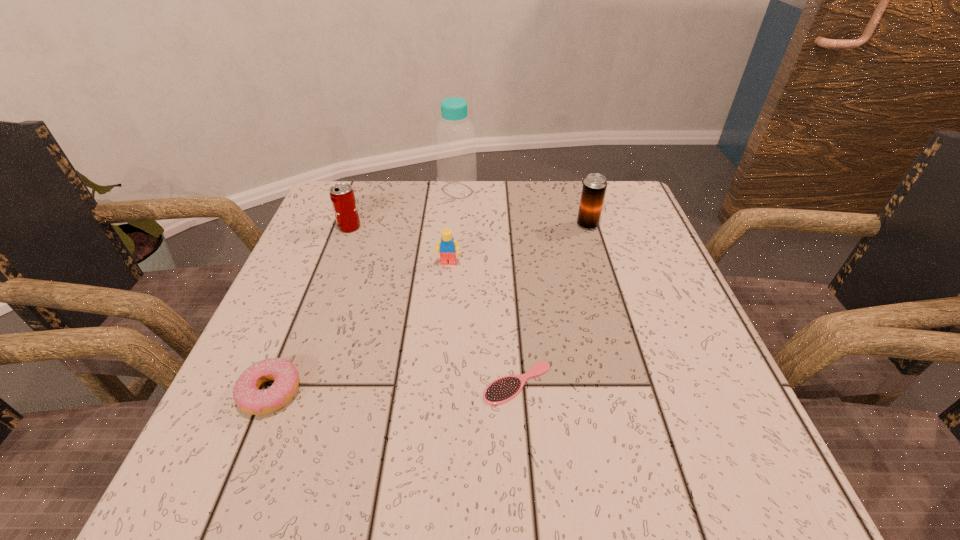
This screenshot has height=540, width=960. I want to click on object that is positioned at the right edge, so click(594, 188).

Image resolution: width=960 pixels, height=540 pixels. I want to click on object located in the far left corner section of the desktop, so click(x=342, y=196).

I want to click on object that is at the far right corner, so click(594, 188).

Locate an element on the screen. vacant space at the far edge of the desktop is located at coordinates (423, 193).

Where is `vacant space at the near edge of the desktop`? This screenshot has height=540, width=960. vacant space at the near edge of the desktop is located at coordinates (619, 444).

In the image, there is a desktop. In order to click on vacant region at the left edge in this screenshot , I will do `click(319, 252)`.

At what (x,y) coordinates should I click in order to perform the action: click on vacant point at the right edge. Please return your answer as a coordinate pair (x, y). The height and width of the screenshot is (540, 960). Looking at the image, I should click on (614, 336).

In order to click on free region at the far left corner of the desktop in this screenshot , I will do `click(318, 217)`.

The image size is (960, 540). In the image, there is a desktop. In order to click on vacant space at the far right corner in this screenshot , I will do `click(621, 224)`.

In the image, there is a desktop. What are the coordinates of `vacant space at the near right corner` in the screenshot? It's located at (703, 446).